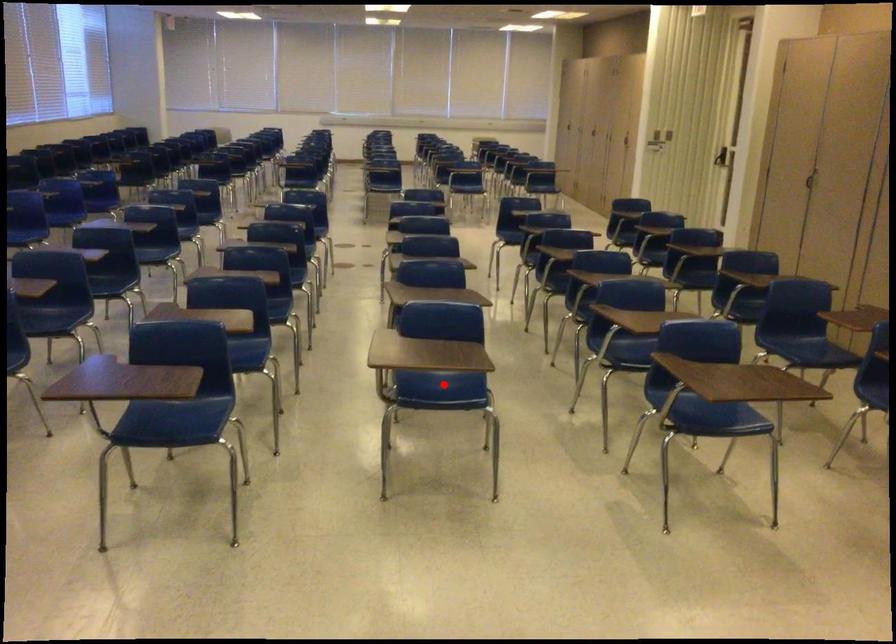
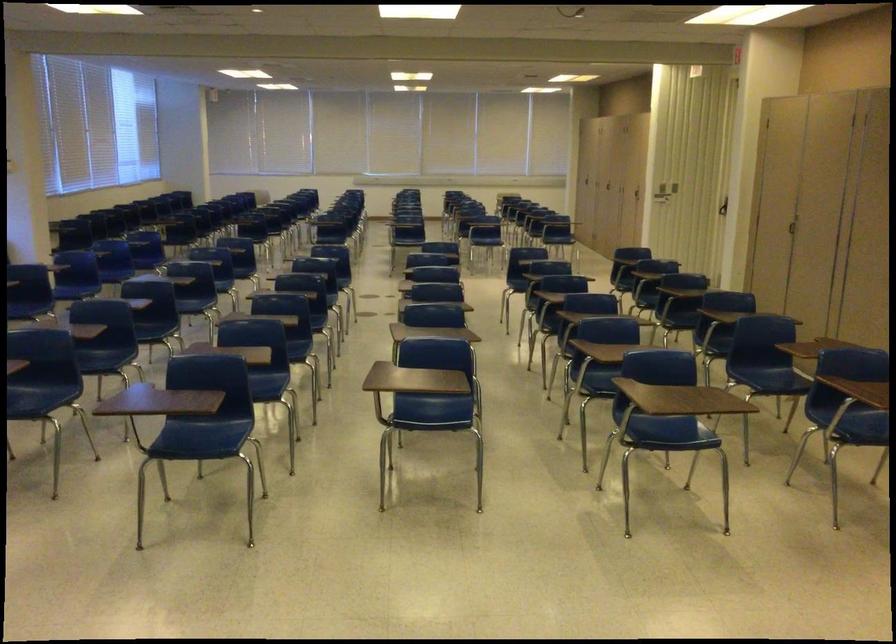
In the second image, find the point that corresponds to the highlighted location in the first image.

(435, 410)